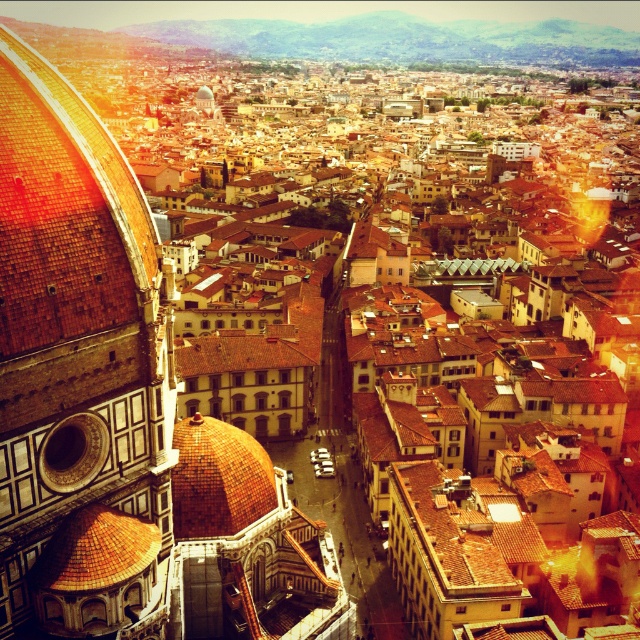
The height and width of the screenshot is (640, 640). Describe the element at coordinates (218, 477) in the screenshot. I see `golden mosaic dome at center` at that location.

Who is shorter, golden mosaic dome at center or brown tiled dome at center-left?

brown tiled dome at center-left

Image resolution: width=640 pixels, height=640 pixels. What do you see at coordinates (218, 477) in the screenshot?
I see `golden mosaic dome at center` at bounding box center [218, 477].

Identify the location of golden mosaic dome at center. (218, 477).

How distant is brown tiled dome at left from brown tiled dome at center-left?

brown tiled dome at left and brown tiled dome at center-left are 8.08 meters apart from each other.

Does brown tiled dome at left come in front of brown tiled dome at center-left?

Yes, brown tiled dome at left is closer to the viewer.

Does point (38, 486) lie in front of point (72, 560)?

Yes, it is.

Where is `brown tiled dome at left`? brown tiled dome at left is located at coordinates (77, 371).

Can you confirm if brown tiled dome at left is thinner than golden mosaic dome at center?

No, brown tiled dome at left is not thinner than golden mosaic dome at center.

You are a GUI agent. You are given a task and a screenshot of the screen. Output one action in this format:
    pyautogui.click(x=<x>, y=<y>)
    Task: Click on the brown tiled dome at left
    The width and height of the screenshot is (640, 640).
    Given the screenshot: What is the action you would take?
    pyautogui.click(x=77, y=371)